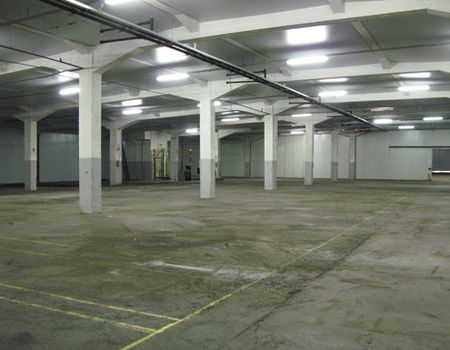
Where is `florescent light`? The height and width of the screenshot is (350, 450). florescent light is located at coordinates (311, 37).